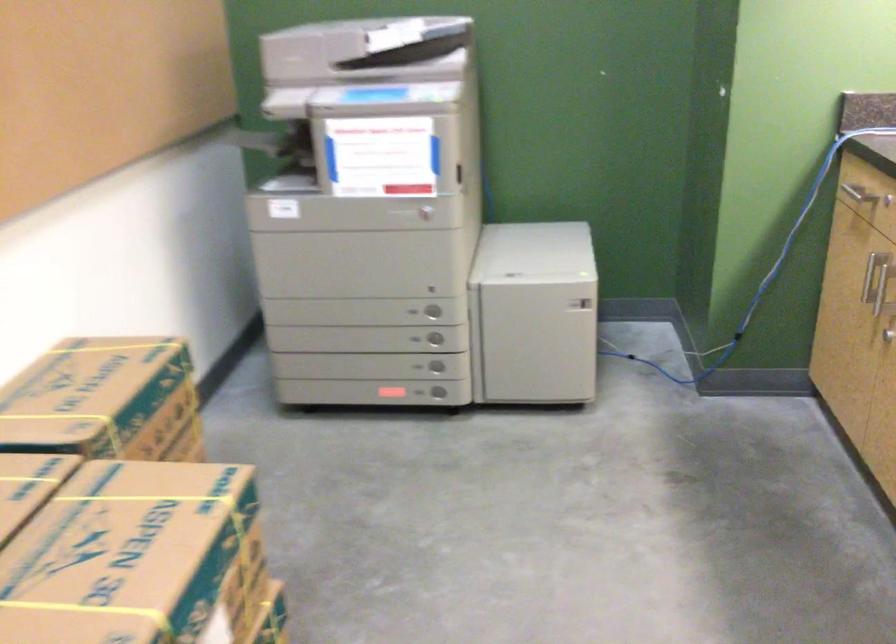
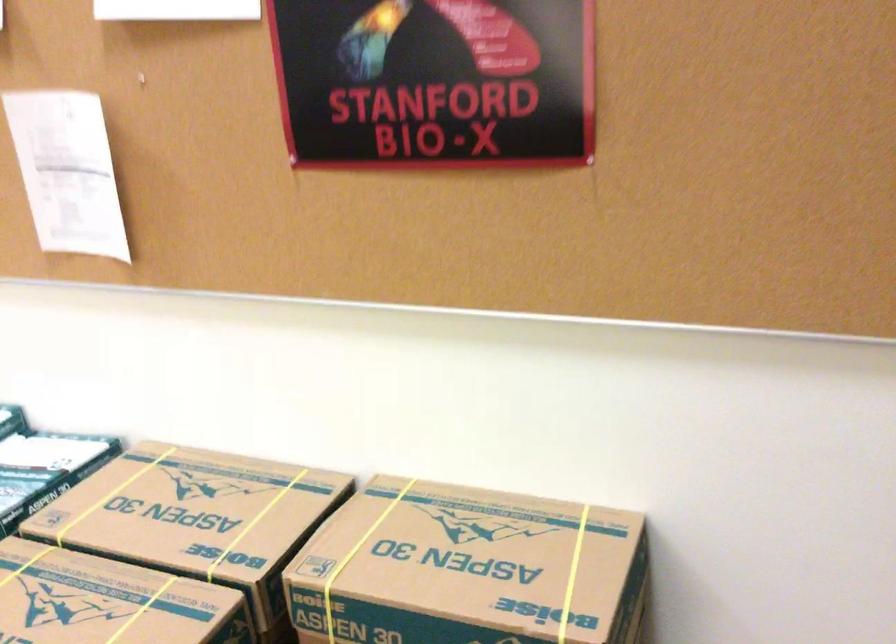
Find the pixel in the second image that matches point 116,374 in the first image.

(468, 569)